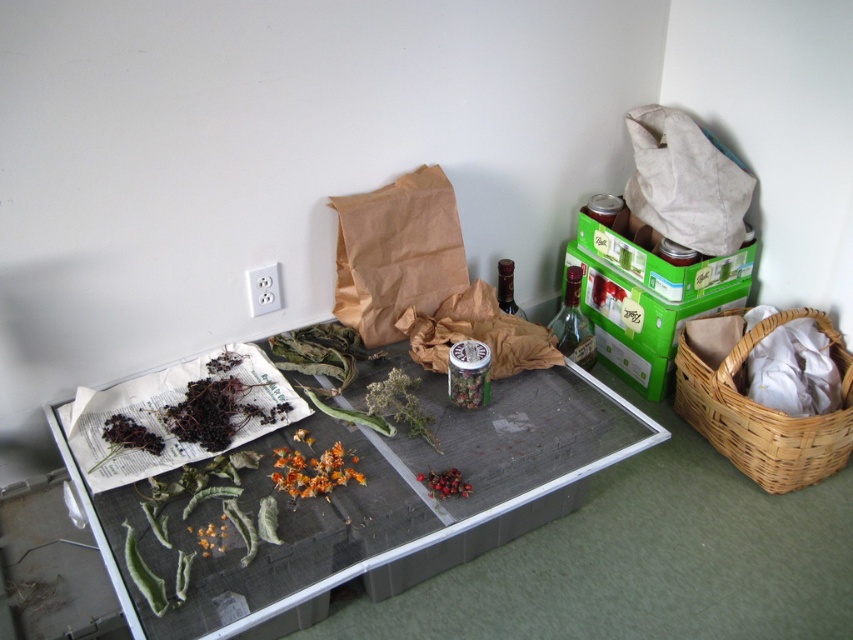
Does white fabric bag at upper right have a greater width compared to bright red berries at center?

Yes, white fabric bag at upper right is wider than bright red berries at center.

Is point (692, 241) positioned after point (432, 490)?

Yes, point (692, 241) is farther from viewer.

You are a GUI agent. You are given a task and a screenshot of the screen. Output one action in this format:
    pyautogui.click(x=<x>, y=<y>)
    Task: Click on the white fabric bag at upper right
    The image size is (853, 640).
    Given the screenshot: What is the action you would take?
    pyautogui.click(x=683, y=182)

Where is `green mesh tray at center`? This screenshot has height=640, width=853. green mesh tray at center is located at coordinates pos(346,497).

Which is in front, point (252, 621) or point (282, 452)?

Positioned in front is point (252, 621).

Where is `green mesh tray at center`? green mesh tray at center is located at coordinates (346, 497).

Is point (422, 195) farther from camera compared to point (328, 448)?

That is True.

Can you confirm if brown paper bag at center is positioned to the left of orange matte flower at center?

No, brown paper bag at center is not to the left of orange matte flower at center.

I want to click on brown paper bag at center, so click(396, 253).